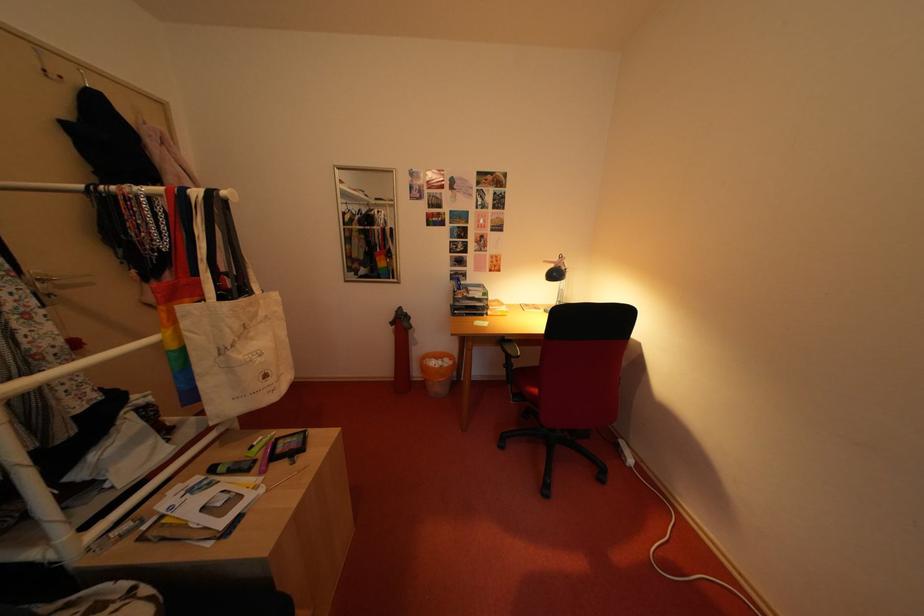
Image resolution: width=924 pixels, height=616 pixels. What do you see at coordinates (523, 383) in the screenshot? I see `a chair armrest` at bounding box center [523, 383].